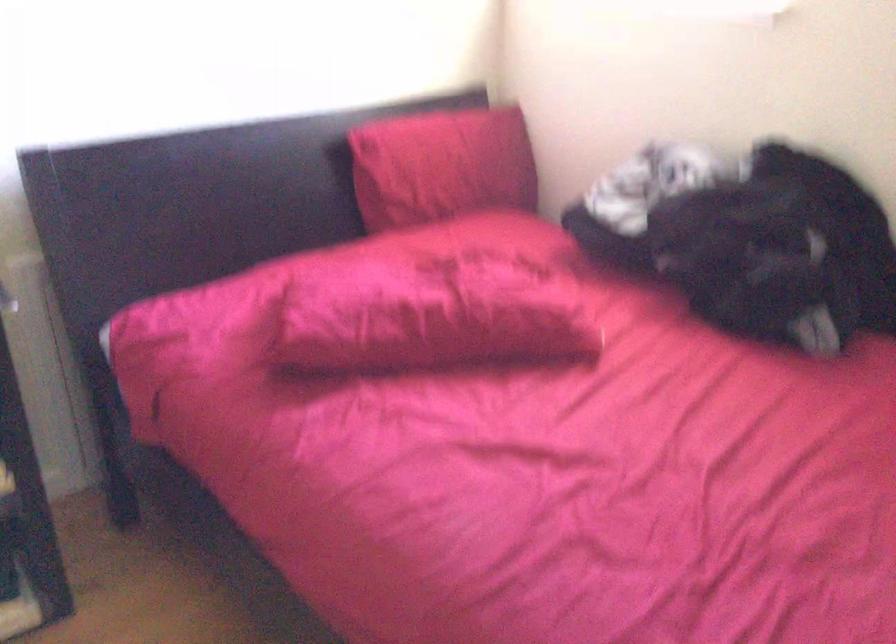
Describe the element at coordinates (431, 316) in the screenshot. I see `the red square pillow` at that location.